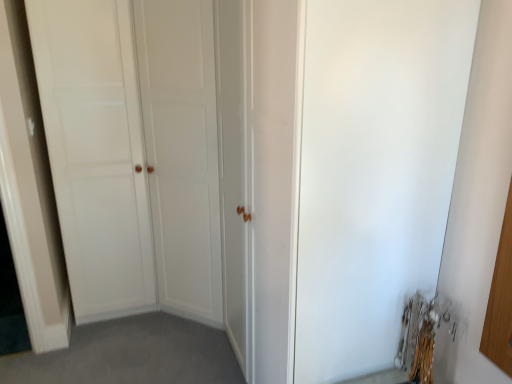
Question: Is white matte screen door at center at the right side of white matte door at center?

Choices:
 (A) no
 (B) yes

Answer: (B)

Question: Considering the relative positions of white matte screen door at center and white matte door at center in the image provided, is white matte screen door at center in front of white matte door at center?

Choices:
 (A) no
 (B) yes

Answer: (B)

Question: Can you confirm if white matte screen door at center is positioned to the left of white matte door at center?

Choices:
 (A) yes
 (B) no

Answer: (B)

Question: Does white matte screen door at center have a larger size compared to white matte door at center?

Choices:
 (A) no
 (B) yes

Answer: (A)

Question: Does white matte screen door at center come behind white matte door at center?

Choices:
 (A) yes
 (B) no

Answer: (B)

Question: Is white matte screen door at center far from white matte door at center?

Choices:
 (A) no
 (B) yes

Answer: (B)

Question: Is white matte door at center facing away from white matte screen door at center?

Choices:
 (A) yes
 (B) no

Answer: (B)

Question: From a real-world perspective, does white matte door at center stand above white matte screen door at center?

Choices:
 (A) yes
 (B) no

Answer: (A)

Question: Can you confirm if white matte door at center is bigger than white matte screen door at center?

Choices:
 (A) no
 (B) yes

Answer: (B)

Question: Does white matte door at center have a lesser width compared to white matte screen door at center?

Choices:
 (A) no
 (B) yes

Answer: (A)

Question: Is white matte door at center in contact with white matte screen door at center?

Choices:
 (A) no
 (B) yes

Answer: (A)

Question: Is white matte door at center closer to camera compared to white matte screen door at center?

Choices:
 (A) no
 (B) yes

Answer: (A)

Question: Is white matte door at center in front of or behind white matte screen door at center in the image?

Choices:
 (A) behind
 (B) front

Answer: (A)